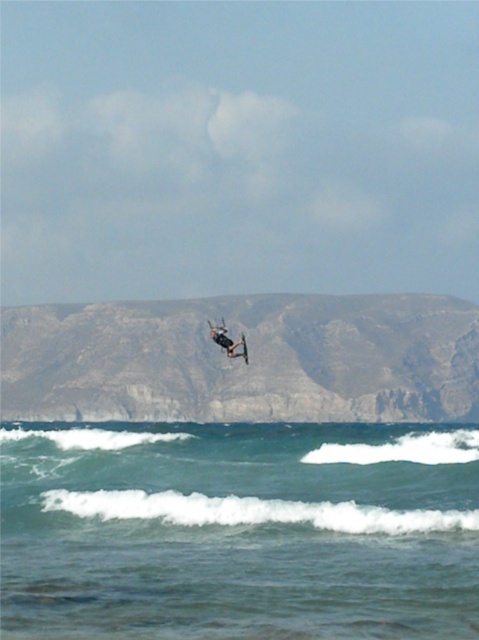
You are a drone operator trying to capture the best aerial shot of the black matte surfboard at center. The drone has a camera with a 120mm focal length lens. To ensure the surfboard is in sharp focus, you need to position the drone directly above the surfboard. Given the coordinates provided in the Objects Description, what are the exact coordinates where you should position the drone to capture the surfboard head on?

The exact coordinates to position the drone directly above the black matte surfboard at center are point (227, 340) as stated in the Objects Description.

You are a photographer trying to capture the perfect shot of the blue water at center and the black matte surfboard at center. Which object in the frame appears bigger to your camera lens?

The blue water at center appears bigger in the frame because it has a larger size compared to the black matte surfboard at center.